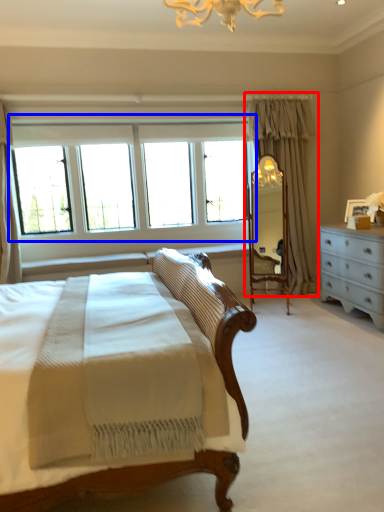
Question: Which object is further to the camera taking this photo, curtain (highlighted by a red box) or window (highlighted by a blue box)?

Choices:
 (A) curtain
 (B) window

Answer: (A)